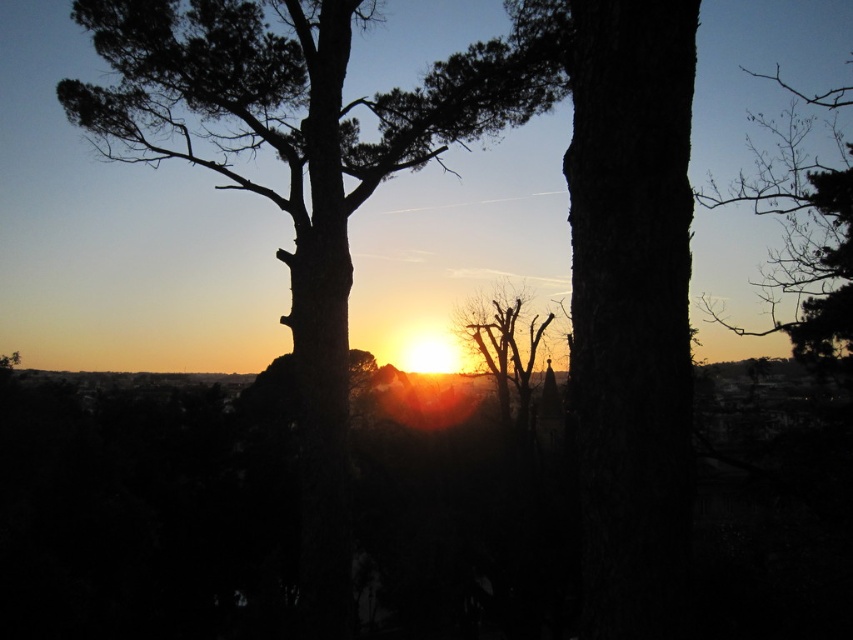
Question: Does bare branches at upper right have a smaller size compared to bare branches at center?

Choices:
 (A) no
 (B) yes

Answer: (A)

Question: Is bare branches at upper right bigger than bare branches at center?

Choices:
 (A) no
 (B) yes

Answer: (B)

Question: Which object appears closest to the camera in this image?

Choices:
 (A) bare branches at center
 (B) bare branches at upper right

Answer: (B)

Question: Can you confirm if bare branches at upper right is positioned to the left of bare branches at center?

Choices:
 (A) yes
 (B) no

Answer: (B)

Question: Which of the following is the closest to the observer?

Choices:
 (A) (850, 282)
 (B) (482, 314)

Answer: (A)